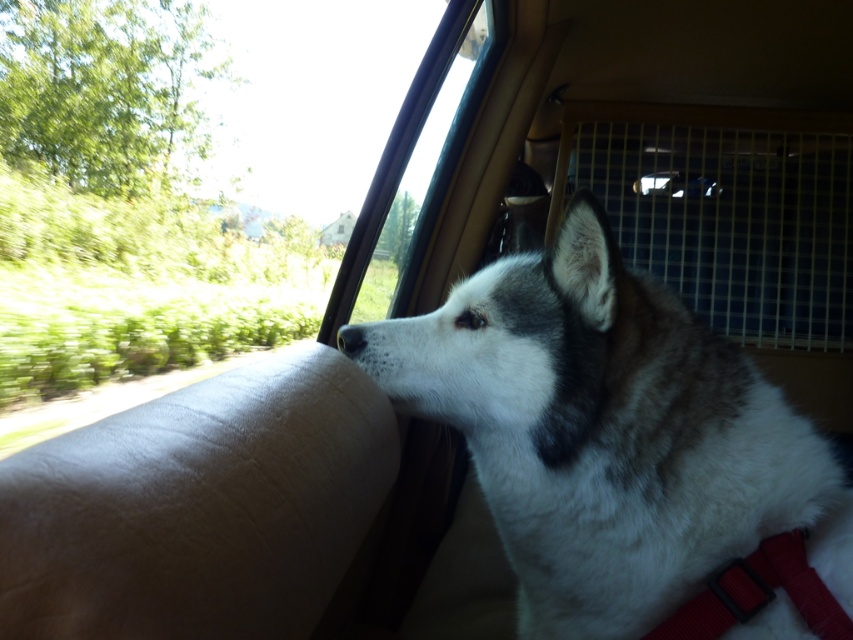
Question: Which of the following is the farthest from the observer?

Choices:
 (A) (346, 344)
 (B) (743, 378)
 (C) (311, 10)

Answer: (C)

Question: Which object is the farthest from the white fur dog at center?

Choices:
 (A) transparent glass window at upper center
 (B) white fur at center

Answer: (A)

Question: Does white fur dog at center have a greater width compared to white fur at center?

Choices:
 (A) yes
 (B) no

Answer: (A)

Question: Can you confirm if white fur dog at center is positioned to the right of transparent glass window at upper center?

Choices:
 (A) no
 (B) yes

Answer: (B)

Question: Among these objects, which one is nearest to the camera?

Choices:
 (A) white fur at center
 (B) white fur dog at center
 (C) transparent glass window at upper center

Answer: (B)

Question: Does white fur dog at center appear over white fur at center?

Choices:
 (A) yes
 (B) no

Answer: (B)